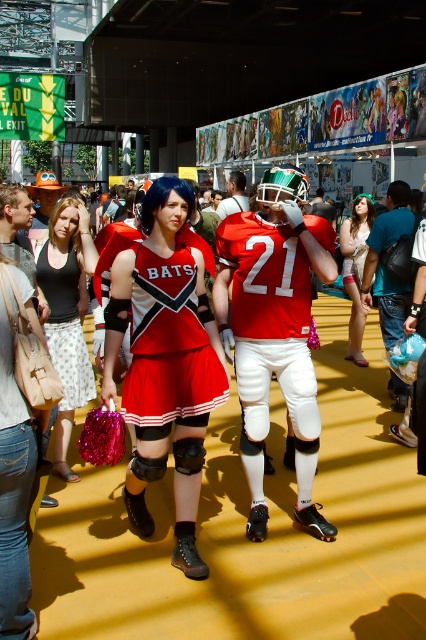
You are a photographer at the event and need to capture both the matte red cheerleader outfit at center and the matte white dress at center in a single frame. Considering their heights, which one should you focus on to ensure both are fully visible in the photo?

The matte red cheerleader outfit at center is taller than the matte white dress at center. To ensure both are fully visible, focus on the matte red cheerleader outfit at center as it is taller, allowing the shorter matte white dress at center to be captured within the frame.

You are a photographer at the event and need to capture a photo of the two people wearing the matte red cheerleading uniform at center and the matte black tank top at center. Since the venue has low lighting, you want to ensure that both outfits are clearly visible. Which of the two outfits should you focus on first to ensure proper exposure?

The matte red cheerleading uniform at center is shorter than the matte black tank top at center, so the matte black tank top at center has a larger surface area and might require more attention to ensure proper exposure.